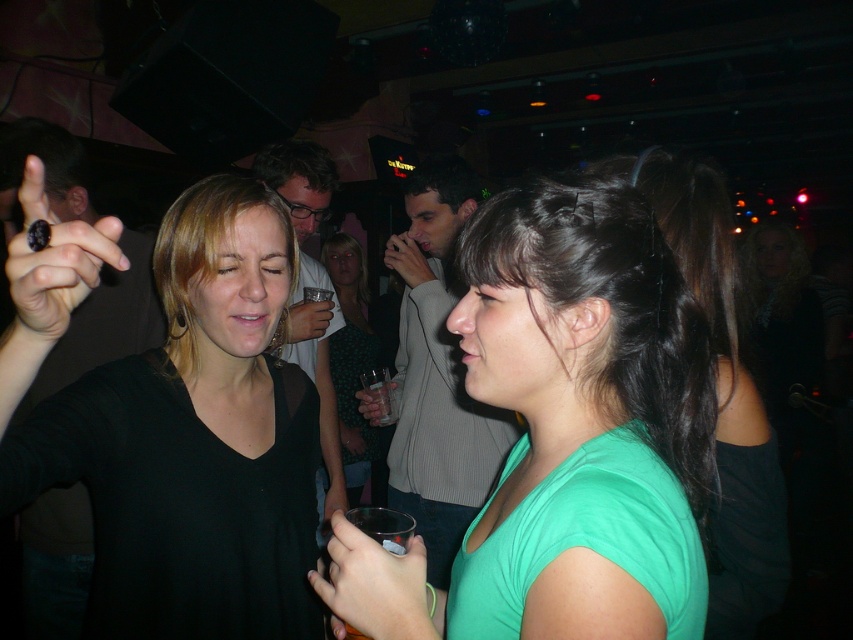
Is gray sweater at center wider than matte black shirt at center?

Yes, gray sweater at center is wider than matte black shirt at center.

What do you see at coordinates (438, 372) in the screenshot? I see `gray sweater at center` at bounding box center [438, 372].

What do you see at coordinates (438, 372) in the screenshot?
I see `gray sweater at center` at bounding box center [438, 372].

You are a GUI agent. You are given a task and a screenshot of the screen. Output one action in this format:
    pyautogui.click(x=<x>, y=<y>)
    Task: Click on the gray sweater at center
    
    Given the screenshot: What is the action you would take?
    pyautogui.click(x=438, y=372)

Which is more to the right, green matte shirt at center or matte black shirt at center?

green matte shirt at center is more to the right.

Is green matte shirt at center positioned before matte black shirt at center?

That is True.

Is point (682, 381) positioned after point (329, 476)?

That is False.

The height and width of the screenshot is (640, 853). Find the location of `green matte shirt at center`. green matte shirt at center is located at coordinates (564, 429).

Where is `black matte shirt at upper left`? Image resolution: width=853 pixels, height=640 pixels. black matte shirt at upper left is located at coordinates (183, 445).

Is black matte shirt at upper left bigger than matte black shirt at center?

No, black matte shirt at upper left is not bigger than matte black shirt at center.

You are a GUI agent. You are given a task and a screenshot of the screen. Output one action in this format:
    pyautogui.click(x=<x>, y=<y>)
    Task: Click on the black matte shirt at upper left
    The height and width of the screenshot is (640, 853).
    Given the screenshot: What is the action you would take?
    pyautogui.click(x=183, y=445)